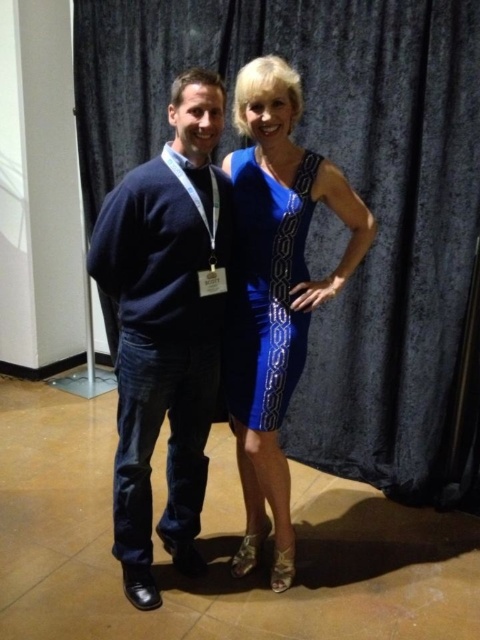
You are a photographer setting up for a group photo. You have a camera with a 2.5 feet wide lens. You need to position yourself so that both the blue satin curtain at center and the dark blue sweater at left are fully within the camera lens view. Is this possible?

The blue satin curtain at center and dark blue sweater at left are 3.58 feet apart from each other. Since the camera lens is only 2.5 feet wide, it cannot capture both objects simultaneously as the distance between them exceeds the lens width.

You are a photographer setting up a shoot with two models wearing the shiny blue dress at center and the blue satin dress at center. You need to position them so that neither is blocking the other. Which dress should be moved back to ensure both are visible?

The blue satin dress at center should be moved back because the shiny blue dress at center is currently in front of it, so moving the blue satin dress further back will ensure both are visible without obstruction.

You are a photographer setting up for a photoshoot. You need to position a light source so that it illuminates the blue satin curtain at center without casting a shadow on the dark blue sweater at left. Where should you place the light source?

The blue satin curtain at center is above the dark blue sweater at left, so placing the light source above the blue satin curtain at center would illuminate it while avoiding casting a shadow on the sweater below.